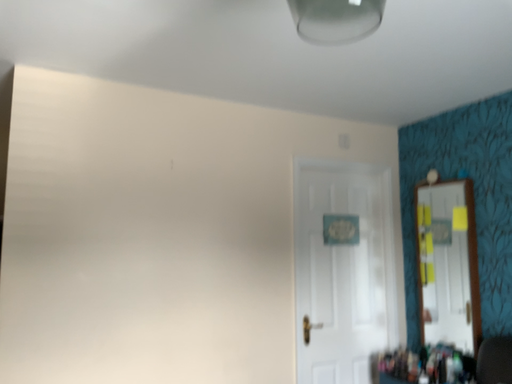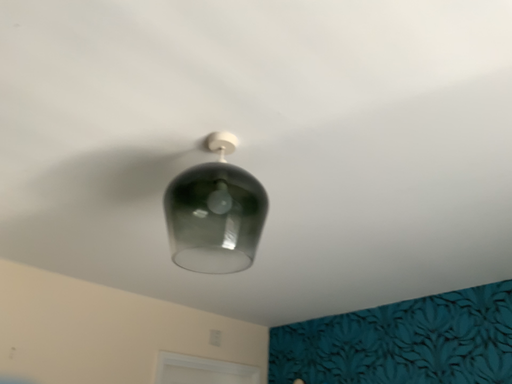
Question: Which way did the camera rotate in the video?

Choices:
 (A) rotated right
 (B) rotated left

Answer: (A)